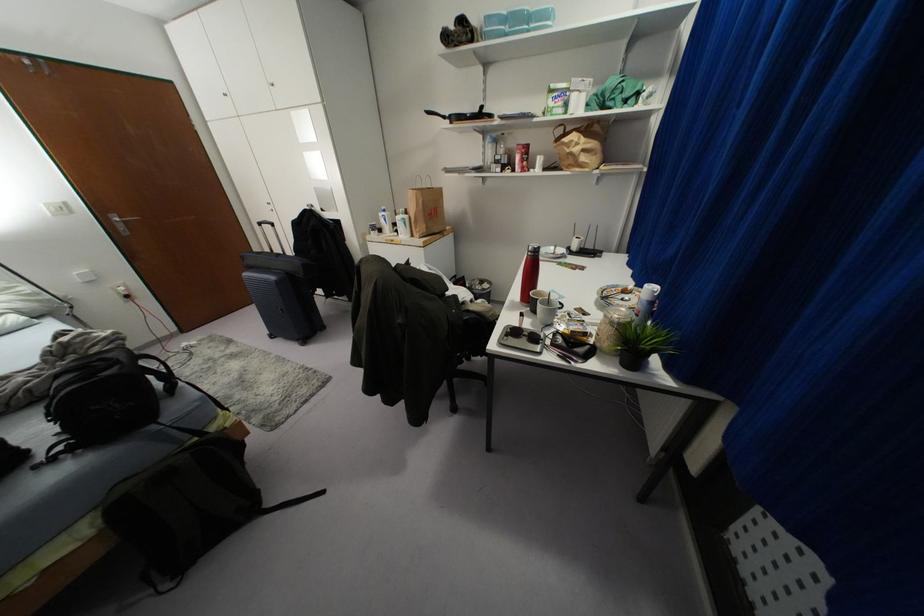
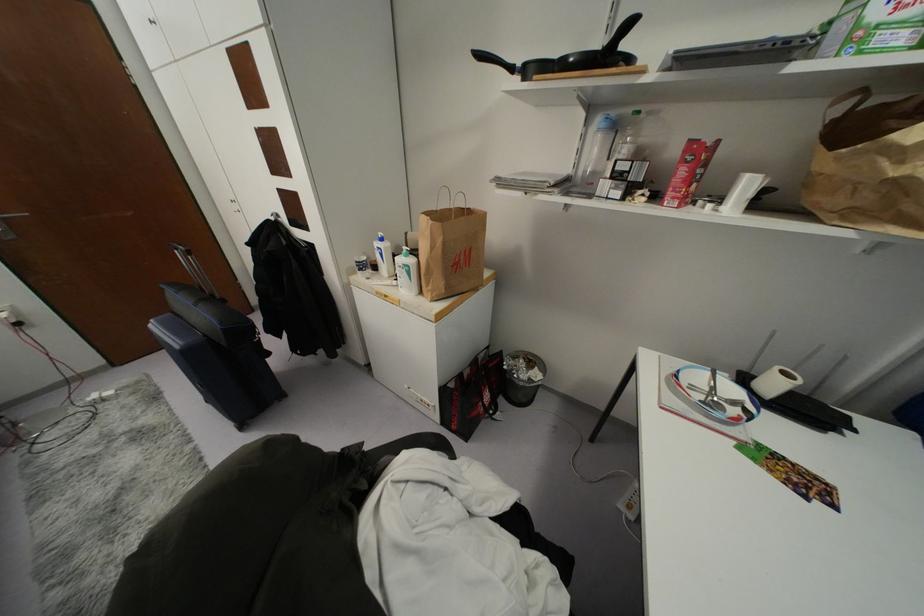
Question: Which direction would the cameraman need to move to produce the second image? Reply with the corresponding letter.

Choices:
 (A) Left
 (B) Right
 (C) Forward
 (D) Backward

Answer: (C)